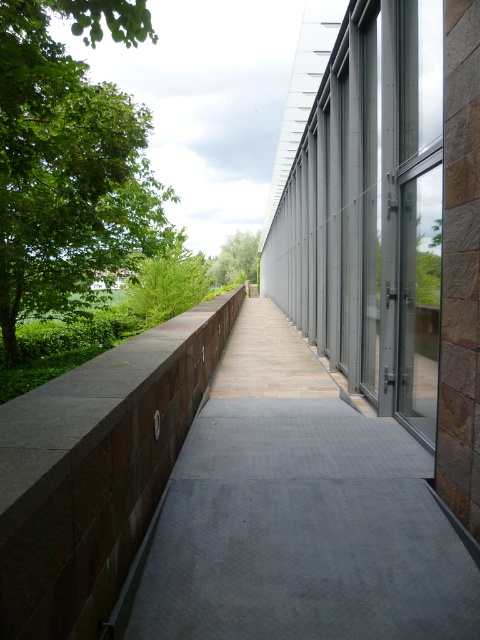
You are standing on the walkway and notice two objects on the left side of the walkway. One is the rustic stone pavement at left, and the other is the green leafy tree at left. Which of these two objects is closer to the center of the walkway?

The rustic stone pavement at left is positioned on the right side of green leafy tree at left, so the rustic stone pavement at left is closer to the center of the walkway than the green leafy tree at left.

In the scene shown: You are a delivery robot with a 2.5 meter long package. You need to navigate through the walkway between the rustic stone pavement at left and the green leafy tree at left. Can you safely pass through the walkway with your package without hitting either side?

The distance between rustic stone pavement at left and green leafy tree at left is 4.21 meters. Since the package is 2.5 meters long, there is enough space to pass safely as 4.21 meters is greater than 2.5 meters.

You are a maintenance worker needing to reach the green leafy tree at left from the walkway. The walkway is 10 feet wide. Can you safely walk across the walkway to the tree?

The distance between the green leafy tree at left and the walkway is 10.68 feet. Since the walkway is only 10 feet wide, you cannot safely reach the tree as the distance exceeds the walkway width.